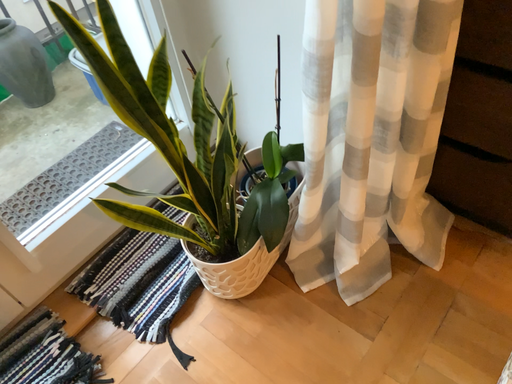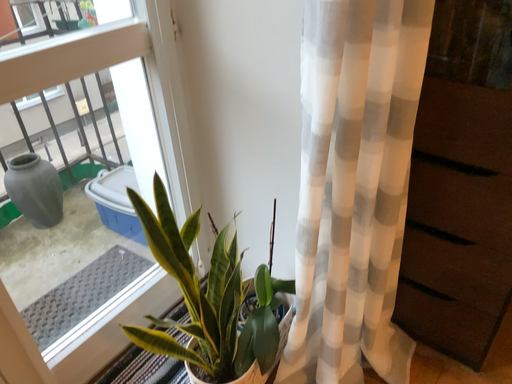
Question: Which way did the camera rotate in the video?

Choices:
 (A) rotated upward
 (B) rotated downward

Answer: (A)